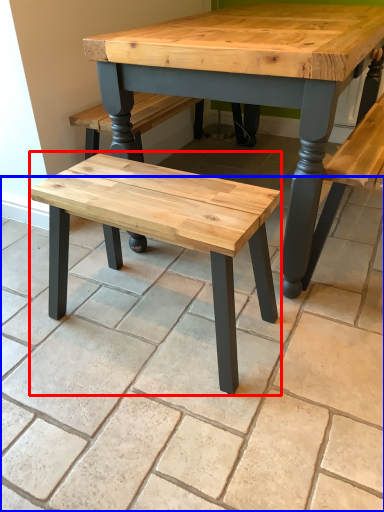
Question: Which point is further to the camera, stool (highlighted by a red box) or tile (highlighted by a blue box)?

Choices:
 (A) stool
 (B) tile

Answer: (A)